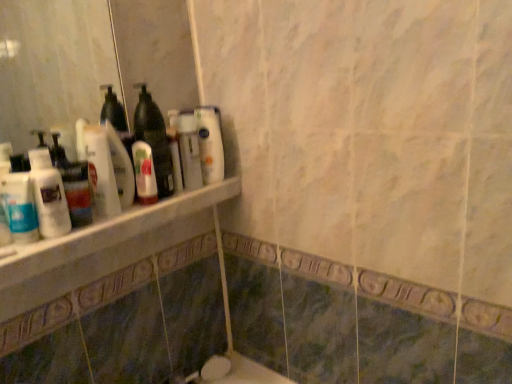
The height and width of the screenshot is (384, 512). Find the location of `free spot to the right of white glossy mouthwash at left, placed as the 1th mouthwash when sorted from left to right`. free spot to the right of white glossy mouthwash at left, placed as the 1th mouthwash when sorted from left to right is located at coordinates click(89, 230).